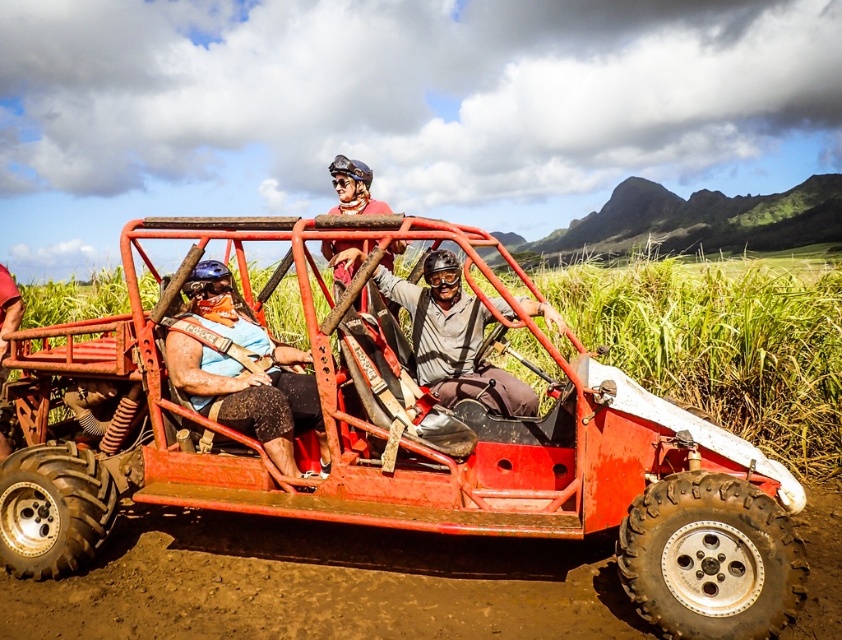
Question: Does matte black helmet at center have a larger size compared to matte black helmet at left?

Choices:
 (A) no
 (B) yes

Answer: (B)

Question: Is metallic red jeep at center thinner than matte black helmet at center?

Choices:
 (A) no
 (B) yes

Answer: (A)

Question: Which of these objects is positioned farthest from the matte black helmet at center?

Choices:
 (A) matte red helmet at center
 (B) matte black helmet at left
 (C) metallic red jeep at center
 (D) matte blue helmet at center

Answer: (B)

Question: Which point is farther to the camera?

Choices:
 (A) matte black helmet at left
 (B) matte black helmet at center

Answer: (A)

Question: Which is nearer to the matte black helmet at left?

Choices:
 (A) metallic red jeep at center
 (B) brown muddy dirt track at lower left

Answer: (A)

Question: Does brown muddy dirt track at lower left have a lesser width compared to matte red helmet at center?

Choices:
 (A) yes
 (B) no

Answer: (B)